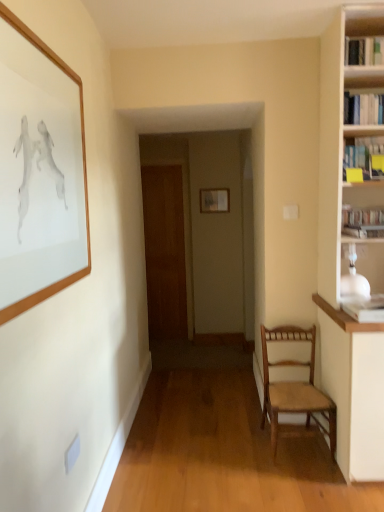
Question: Is wooden picture frame at center, acting as the 1th picture frame starting from the right, inside or outside of wooden picture frame at upper left, placed as the first picture frame when sorted from left to right?

Choices:
 (A) inside
 (B) outside

Answer: (B)

Question: Looking at the image, does wooden picture frame at center, arranged as the second picture frame when viewed from the left, seem bigger or smaller compared to wooden picture frame at upper left, the first picture frame viewed from the front?

Choices:
 (A) small
 (B) big

Answer: (A)

Question: Estimate the real-world distances between objects in this image. Which object is farther from the hardcover book at upper right, which is the fourth book from bottom to top?

Choices:
 (A) yellow paper at upper right, which is the second book in bottom-to-top order
 (B) hardcover book at right, placed as the fourth book when sorted from top to bottom
 (C) brown wooden door at center
 (D) wooden picture frame at center, which is counted as the first picture frame, starting from the back
 (E) wooden picture frame at upper left, the first picture frame viewed from the front

Answer: (C)

Question: Which of these objects is positioned closest to the wooden woven seat chair at lower right?

Choices:
 (A) hardcover book at right, placed as the fourth book when sorted from top to bottom
 (B) wooden picture frame at upper left, the first picture frame viewed from the front
 (C) yellow paper at upper right, which is the second book in bottom-to-top order
 (D) wooden picture frame at center, acting as the 1th picture frame starting from the right
 (E) hardcover book at upper right, positioned as the first book in top-to-bottom order

Answer: (A)